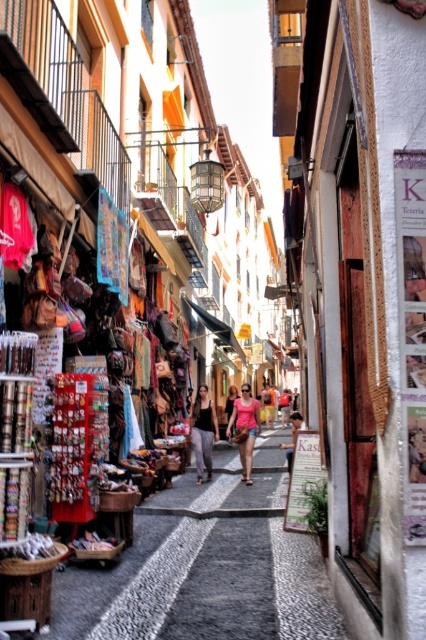
Can you confirm if smooth stone alley at center is positioned to the right of matte black tank top at center?

Indeed, smooth stone alley at center is positioned on the right side of matte black tank top at center.

Is point (219, 476) less distant than point (196, 428)?

No, it is not.

Locate an element on the screen. smooth stone alley at center is located at coordinates (207, 566).

Can you confirm if pink fabric shorts at center is shorter than matte black tank top at center?

Yes.

Is pink fabric shorts at center bigger than matte black tank top at center?

No.

At what (x,y) coordinates should I click in order to perform the action: click on pink fabric shorts at center. Please return your answer as a coordinate pair (x, y). The width and height of the screenshot is (426, 640). Looking at the image, I should click on (244, 428).

The image size is (426, 640). In order to click on pink fabric shorts at center in this screenshot , I will do `click(244, 428)`.

Is smooth stone alley at center wider than pink fabric shorts at center?

Yes, smooth stone alley at center is wider than pink fabric shorts at center.

Looking at this image, which is below, smooth stone alley at center or pink fabric shorts at center?

smooth stone alley at center

You are a GUI agent. You are given a task and a screenshot of the screen. Output one action in this format:
    pyautogui.click(x=<x>, y=<y>)
    Task: Click on the smooth stone alley at center
    The width and height of the screenshot is (426, 640).
    Given the screenshot: What is the action you would take?
    pyautogui.click(x=207, y=566)

The height and width of the screenshot is (640, 426). I want to click on smooth stone alley at center, so click(207, 566).